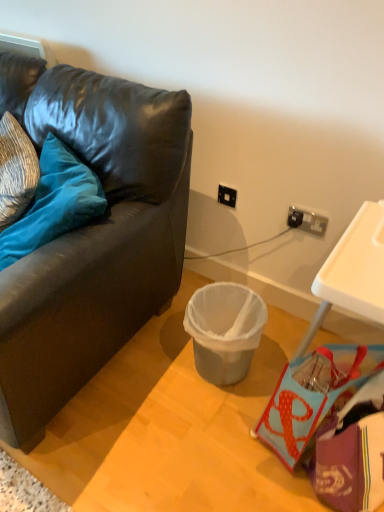
Image resolution: width=384 pixels, height=512 pixels. Describe the element at coordinates (54, 203) in the screenshot. I see `velvet blue pillow at left` at that location.

What is the approximate width of purple fabric handbag at lower right?

It is 19.46 inches.

Describe the element at coordinates (307, 221) in the screenshot. I see `black plastic power outlet at upper right, the second power outlet viewed from the left` at that location.

In order to face gray plastic trash can at center, should I rotate leftwards or rightwards?

A 4.731 degree turn to the right will do.

The image size is (384, 512). Describe the element at coordinates (224, 330) in the screenshot. I see `gray plastic trash can at center` at that location.

You are a GUI agent. You are given a task and a screenshot of the screen. Output one action in this format:
    pyautogui.click(x=<x>, y=<y>)
    Task: Click on the velvet blue pillow at left
    
    Given the screenshot: What is the action you would take?
    pyautogui.click(x=54, y=203)

Is black plastic power outlet at upper right, the second power outlet viewed from the left, at the back of matte black couch at lower left?

matte black couch at lower left is not turned away from black plastic power outlet at upper right, the second power outlet viewed from the left.

Considering the relative positions of matte black couch at lower left and black plastic power outlet at upper right, marked as the first power outlet in a bottom-to-top arrangement, in the image provided, is matte black couch at lower left behind black plastic power outlet at upper right, marked as the first power outlet in a bottom-to-top arrangement,?

No, it is in front of black plastic power outlet at upper right, marked as the first power outlet in a bottom-to-top arrangement.

From the image's perspective, is matte black couch at lower left over black plastic power outlet at upper right, the 2th power outlet viewed from the top?

Correct, matte black couch at lower left appears higher than black plastic power outlet at upper right, the 2th power outlet viewed from the top, in the image.

Is black plastic power outlet at upper right, marked as the first power outlet in a bottom-to-top arrangement, completely or partially inside matte black couch at lower left?

No, matte black couch at lower left does not contain black plastic power outlet at upper right, marked as the first power outlet in a bottom-to-top arrangement.

Find the location of a particular element. studio couch on the left side of purple fabric handbag at lower right is located at coordinates (92, 236).

Can you tell me how much matte black couch at lower left and purple fabric handbag at lower right differ in facing direction?

The angle between the facing direction of matte black couch at lower left and the facing direction of purple fabric handbag at lower right is 23 degrees.

From the image's perspective, does matte black couch at lower left appear lower than purple fabric handbag at lower right?

Actually, matte black couch at lower left appears above purple fabric handbag at lower right in the image.

Considering the sizes of objects matte black couch at lower left and purple fabric handbag at lower right in the image provided, who is smaller, matte black couch at lower left or purple fabric handbag at lower right?

With smaller size is purple fabric handbag at lower right.

Does velvet blue pillow at left turn towards purple fabric handbag at lower right?

No, velvet blue pillow at left is not facing towards purple fabric handbag at lower right.

Find the location of `handbag that is in front of the velvet blue pillow at left`. handbag that is in front of the velvet blue pillow at left is located at coordinates (314, 395).

In the scene shown: Looking at their sizes, would you say velvet blue pillow at left is wider or thinner than purple fabric handbag at lower right?

Considering their sizes, velvet blue pillow at left looks slimmer than purple fabric handbag at lower right.

Considering the sizes of velvet blue pillow at left and purple fabric handbag at lower right in the image, is velvet blue pillow at left taller or shorter than purple fabric handbag at lower right?

In the image, velvet blue pillow at left appears to be taller than purple fabric handbag at lower right.

What's the angular difference between purple fabric handbag at lower right and black plastic power outlet at upper right, marked as the second power outlet in a front-to-back arrangement,'s facing directions?

The angle between the facing direction of purple fabric handbag at lower right and the facing direction of black plastic power outlet at upper right, marked as the second power outlet in a front-to-back arrangement, is 23.9 degrees.

Which point is more forward, (362, 370) or (230, 194)?

The point (362, 370) is more forward.

Is purple fabric handbag at lower right taller or shorter than black plastic power outlet at upper right, which appears as the 1th power outlet when viewed from the left?

Considering their sizes, purple fabric handbag at lower right has more height than black plastic power outlet at upper right, which appears as the 1th power outlet when viewed from the left.

From a real-world perspective, which power outlet is the 2nd one above the purple fabric handbag at lower right? Please provide its 2D coordinates.

[(227, 196)]

Is purple fabric handbag at lower right next to gray plastic trash can at center and touching it?

No, purple fabric handbag at lower right is not touching gray plastic trash can at center.

Would you say purple fabric handbag at lower right contains gray plastic trash can at center?

Actually, gray plastic trash can at center is outside purple fabric handbag at lower right.

Is point (296, 376) positioned in front of point (206, 373)?

Yes, it is.

From the picture: Considering the relative positions of purple fabric handbag at lower right and gray plastic trash can at center in the image provided, is purple fabric handbag at lower right to the left of gray plastic trash can at center from the viewer's perspective?

In fact, purple fabric handbag at lower right is to the right of gray plastic trash can at center.

This screenshot has height=512, width=384. Find the location of `trash bin/can in front of the black plastic power outlet at upper right, which appears as the 1th power outlet when viewed from the left`. trash bin/can in front of the black plastic power outlet at upper right, which appears as the 1th power outlet when viewed from the left is located at coordinates [x=224, y=330].

Does black plastic power outlet at upper right, marked as the 2th power outlet in a bottom-to-top arrangement, contain gray plastic trash can at center?

That's incorrect, gray plastic trash can at center is not inside black plastic power outlet at upper right, marked as the 2th power outlet in a bottom-to-top arrangement.

From the image's perspective, who appears lower, black plastic power outlet at upper right, marked as the 2th power outlet in a bottom-to-top arrangement, or gray plastic trash can at center?

gray plastic trash can at center is shown below in the image.

Can you confirm if black plastic power outlet at upper right, which appears as the 1th power outlet when viewed from the left, is taller than gray plastic trash can at center?

Incorrect, the height of black plastic power outlet at upper right, which appears as the 1th power outlet when viewed from the left, is not larger of that of gray plastic trash can at center.

Measure the distance between gray plastic trash can at center and black plastic power outlet at upper right, the 2th power outlet positioned from the back.

A distance of 18.61 inches exists between gray plastic trash can at center and black plastic power outlet at upper right, the 2th power outlet positioned from the back.

From a real-world perspective, is gray plastic trash can at center on top of black plastic power outlet at upper right, the second power outlet viewed from the left?

Incorrect, from a real-world perspective, gray plastic trash can at center is lower than black plastic power outlet at upper right, the second power outlet viewed from the left.

The width and height of the screenshot is (384, 512). I want to click on trash bin/can below the black plastic power outlet at upper right, marked as the first power outlet in a bottom-to-top arrangement (from the image's perspective), so [x=224, y=330].

Does gray plastic trash can at center turn towards black plastic power outlet at upper right, the 2th power outlet positioned from the back?

No, gray plastic trash can at center is not oriented towards black plastic power outlet at upper right, the 2th power outlet positioned from the back.

This screenshot has height=512, width=384. In order to click on power outlet below the matte black couch at lower left (from the image's perspective) in this screenshot , I will do `click(307, 221)`.

At what (x,y) coordinates should I click in order to perform the action: click on studio couch above the purple fabric handbag at lower right (from the image's perspective). Please return your answer as a coordinate pair (x, y). Looking at the image, I should click on (92, 236).

From the image, which object appears to be nearer to velvet blue pillow at left, matte black couch at lower left or purple fabric handbag at lower right?

matte black couch at lower left.

From the image, which object appears to be farther from gray plastic trash can at center, velvet blue pillow at left or matte black couch at lower left?

velvet blue pillow at left is further to gray plastic trash can at center.

From the image, which object appears to be nearer to black plastic power outlet at upper right, the first power outlet in the top-to-bottom sequence, matte black couch at lower left or velvet blue pillow at left?

The object closer to black plastic power outlet at upper right, the first power outlet in the top-to-bottom sequence, is matte black couch at lower left.

Considering their positions, is black plastic power outlet at upper right, the 2th power outlet viewed from the top, positioned further to velvet blue pillow at left than purple fabric handbag at lower right?

purple fabric handbag at lower right lies further to velvet blue pillow at left than the other object.

Looking at the image, which one is located further to velvet blue pillow at left, black plastic power outlet at upper right, the first power outlet in the top-to-bottom sequence, or black plastic power outlet at upper right, the second power outlet viewed from the left?

black plastic power outlet at upper right, the second power outlet viewed from the left.

Estimate the real-world distances between objects in this image. Which object is closer to gray plastic trash can at center, purple fabric handbag at lower right or black plastic power outlet at upper right, marked as the 2th power outlet in a bottom-to-top arrangement?

purple fabric handbag at lower right is closer to gray plastic trash can at center.

Based on their spatial positions, is black plastic power outlet at upper right, marked as the first power outlet in a bottom-to-top arrangement, or gray plastic trash can at center closer to black plastic power outlet at upper right, which is counted as the 2th power outlet, starting from the right?

black plastic power outlet at upper right, marked as the first power outlet in a bottom-to-top arrangement, lies closer to black plastic power outlet at upper right, which is counted as the 2th power outlet, starting from the right, than the other object.

Considering their positions, is matte black couch at lower left positioned closer to gray plastic trash can at center than black plastic power outlet at upper right, which is counted as the first power outlet, starting from the back?

matte black couch at lower left is positioned closer to the anchor gray plastic trash can at center.

Find the location of `trash bin/can situated between matte black couch at lower left and purple fabric handbag at lower right from left to right`. trash bin/can situated between matte black couch at lower left and purple fabric handbag at lower right from left to right is located at coordinates (224, 330).

Where is `pillow between matte black couch at lower left and gray plastic trash can at center from left to right`? The width and height of the screenshot is (384, 512). pillow between matte black couch at lower left and gray plastic trash can at center from left to right is located at coordinates (54, 203).

Locate an element on the screen. This screenshot has width=384, height=512. trash bin/can situated between velvet blue pillow at left and black plastic power outlet at upper right, marked as the first power outlet in a bottom-to-top arrangement, from left to right is located at coordinates (224, 330).

Find the location of `trash bin/can between matte black couch at lower left and black plastic power outlet at upper right, the 2th power outlet viewed from the top, from left to right`. trash bin/can between matte black couch at lower left and black plastic power outlet at upper right, the 2th power outlet viewed from the top, from left to right is located at coordinates (224, 330).